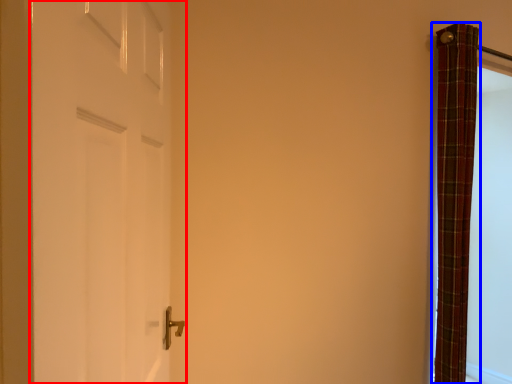
Question: Which object is further to the camera taking this photo, door (highlighted by a red box) or curtain (highlighted by a blue box)?

Choices:
 (A) door
 (B) curtain

Answer: (B)